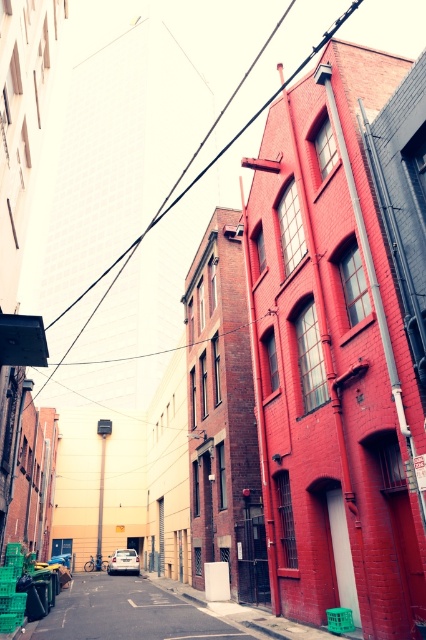
You are standing in the middle of the alleyway and want to determine which of the two points, point (120, 595) or point (138, 237), is closer to you. Based on the description, which point is nearer?

Point (120, 595) is further to the viewer than point (138, 237). Therefore, point (138, 237) is closer to you.

You are standing in the middle of the alleyway and notice a point at coordinates [101,484]. What object is located at that point?

The metallic rectangular sign at center is located at point [101,484].

You are standing at the entrance of the alleyway and want to park your matte black car at center. According to the image, where exactly is the car located in the alleyway?

The matte black car at center is located at point 0.959 on the x axis and 0.303 on the y axis in the alleyway.